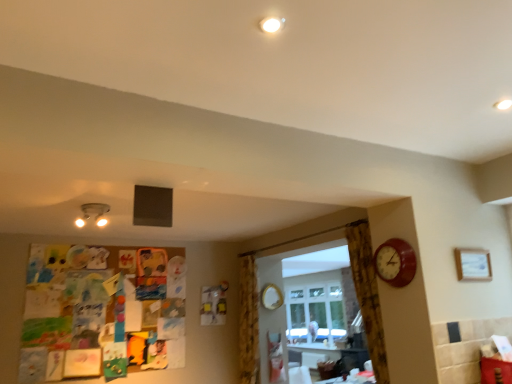
Question: From the image's perspective, is wooden picture frame at upper right beneath yellow floral fabric curtain at center, the first curtain viewed from the left?

Choices:
 (A) yes
 (B) no

Answer: (B)

Question: Can you confirm if wooden picture frame at upper right is wider than yellow floral fabric curtain at center, which is the 2th curtain in right-to-left order?

Choices:
 (A) yes
 (B) no

Answer: (B)

Question: Could you tell me if wooden picture frame at upper right is facing yellow floral fabric curtain at center, the second curtain positioned from the front?

Choices:
 (A) no
 (B) yes

Answer: (A)

Question: Can you confirm if wooden picture frame at upper right is bigger than yellow floral fabric curtain at center, the first curtain viewed from the left?

Choices:
 (A) yes
 (B) no

Answer: (B)

Question: Does wooden picture frame at upper right have a smaller size compared to yellow floral fabric curtain at center, which is the 2th curtain in right-to-left order?

Choices:
 (A) no
 (B) yes

Answer: (B)

Question: Considering their positions, is matte white lamp at upper left located in front of or behind gold metallic mirror at center?

Choices:
 (A) front
 (B) behind

Answer: (A)

Question: Is matte white lamp at upper left taller or shorter than gold metallic mirror at center?

Choices:
 (A) tall
 (B) short

Answer: (B)

Question: Is point (80, 221) positioned closer to the camera than point (275, 299)?

Choices:
 (A) closer
 (B) farther

Answer: (A)

Question: From a real-world perspective, is matte white lamp at upper left above or below gold metallic mirror at center?

Choices:
 (A) above
 (B) below

Answer: (A)

Question: Which is correct: brown textured curtain at right, the second curtain when ordered from back to front, is inside wooden picture frame at upper right, or outside of it?

Choices:
 (A) outside
 (B) inside

Answer: (A)

Question: In terms of height, does brown textured curtain at right, the second curtain when ordered from back to front, look taller or shorter compared to wooden picture frame at upper right?

Choices:
 (A) short
 (B) tall

Answer: (B)

Question: In terms of width, does brown textured curtain at right, acting as the 2th curtain starting from the left, look wider or thinner when compared to wooden picture frame at upper right?

Choices:
 (A) wide
 (B) thin

Answer: (A)

Question: Looking at the image, does brown textured curtain at right, acting as the 2th curtain starting from the left, seem bigger or smaller compared to wooden picture frame at upper right?

Choices:
 (A) small
 (B) big

Answer: (B)

Question: In terms of size, does matte white lamp at upper left appear bigger or smaller than wooden clock at right?

Choices:
 (A) small
 (B) big

Answer: (B)

Question: Considering the positions of matte white lamp at upper left and wooden clock at right in the image, is matte white lamp at upper left taller or shorter than wooden clock at right?

Choices:
 (A) tall
 (B) short

Answer: (B)